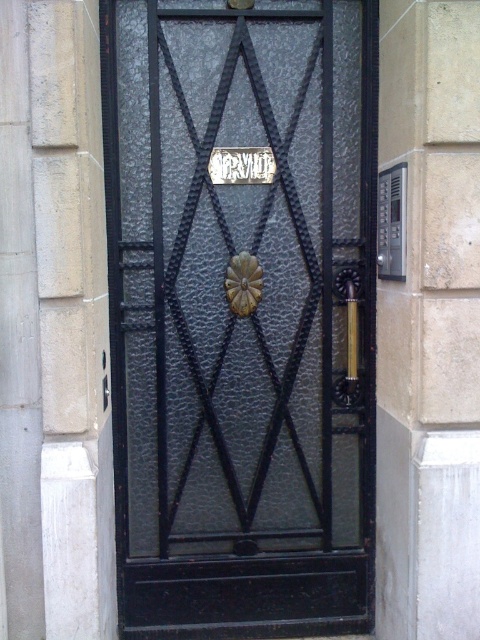
In the scene shown: You are standing in front of the black metal gate with intricate geometric patterns. You need to reach the gold metallic door handle at right to open the gate. Considering your height is 1.7 meters, can you comfortably reach the handle without any assistance?

The gold metallic door handle at right is 3.37 meters away from the camera. Since the handle is positioned 3.37 meters away and your height is 1.7 meters, you can comfortably reach it without needing assistance as the distance is within a typical comfortable reaching range for most adults.

You are a delivery person trying to enter through the black textured metal door at center. You need to locate the gold metallic door handle at right to open it. Based on the scene description, where should you look relative to the door?

The gold metallic door handle at right is located below the black textured metal door at center, so you should look downward from the door to find it.

You are a delivery person holding a package that requires you to reach both the black textured metal door at center and the gold textured door handle at center to deliver it. Given that your arms can extend 30 centimeters, can you comfortably reach both items without moving your position?

The black textured metal door at center and the gold textured door handle at center are 33.87 centimeters apart from each other. Since your arms can only extend 30 centimeters, you cannot comfortably reach both items without moving your position.